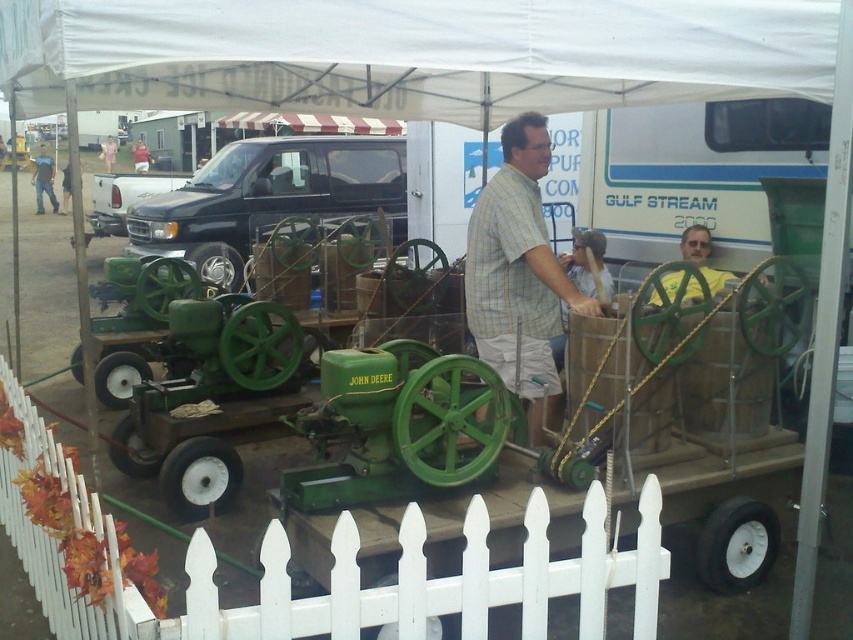
You are standing at the point marked as point (337,570) in the image. What object is located exactly at that point?

The white picket fence at center is located exactly at point (337,570).

You are at the fair and want to take a photo of the vintage John Deere tractor. You notice a white picket fence at center and a checkered fabric shirt at center in the background. Which object should you position to the right side of your camera frame to include both the tractor and the shirt?

To include both the vintage John Deere tractor and the checkered fabric shirt at center in your photo, position the white picket fence at center to the right side of your camera frame since the white picket fence at center is to the left of the checkered fabric shirt at center. This way, arranging them from left to right would place the fence first, followed by the shirt, ensuring both are visible in the frame.

You are standing at the fairground and want to take a photo of the tractor and the trailer. The tractor is at point (339, 608) and the trailer is at point (660, 282). Which point should you focus on first to ensure both are in the frame?

You should focus on point (339, 608) first because it is closer to the camera, ensuring both the tractor and the trailer at point (660, 282) will be in the frame.